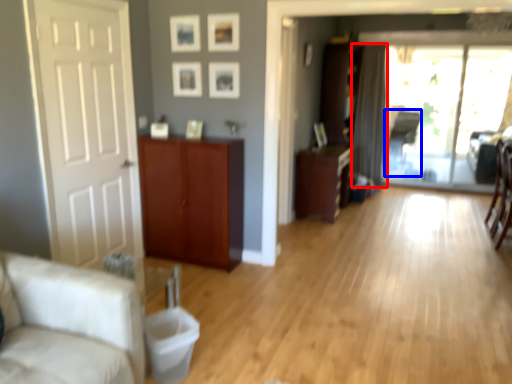
Question: Which object appears farthest to the camera in this image, curtain (highlighted by a red box) or armchair (highlighted by a blue box)?

Choices:
 (A) curtain
 (B) armchair

Answer: (B)